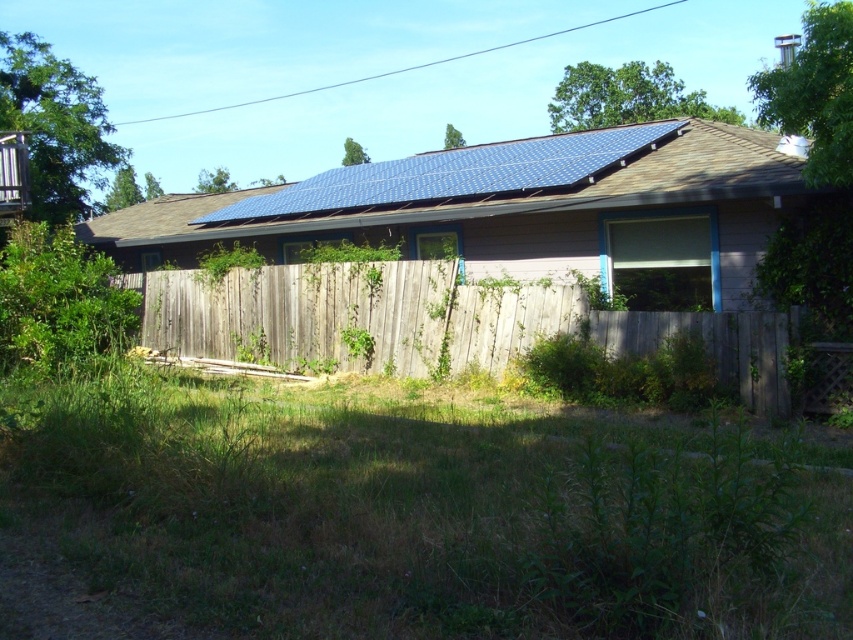
Can you confirm if green grass at lower center is positioned to the left of weathered wood fence at center?

Result: In fact, green grass at lower center is to the right of weathered wood fence at center.

At what (x,y) coordinates should I click in order to perform the action: click on green grass at lower center. Please return your answer as a coordinate pair (x, y). The image size is (853, 640). Looking at the image, I should click on [425, 516].

Between point (634, 428) and point (773, 339), which one is positioned in front?

Point (634, 428)

I want to click on green grass at lower center, so click(x=425, y=516).

Which of these two, blue solar panel at upper center or weathered wood fence at center, stands shorter?

Standing shorter between the two is weathered wood fence at center.

Does blue solar panel at upper center have a smaller size compared to weathered wood fence at center?

No.

Which is in front, point (323, 216) or point (276, 332)?

Point (276, 332)

The height and width of the screenshot is (640, 853). I want to click on blue solar panel at upper center, so click(514, 209).

Does point (349, 483) lie behind point (289, 202)?

No, (349, 483) is in front of (289, 202).

Who is higher up, green grass at lower center or blue solar panel at upper center?

blue solar panel at upper center is higher up.

At what (x,y) coordinates should I click in order to perform the action: click on green grass at lower center. Please return your answer as a coordinate pair (x, y). Looking at the image, I should click on (425, 516).